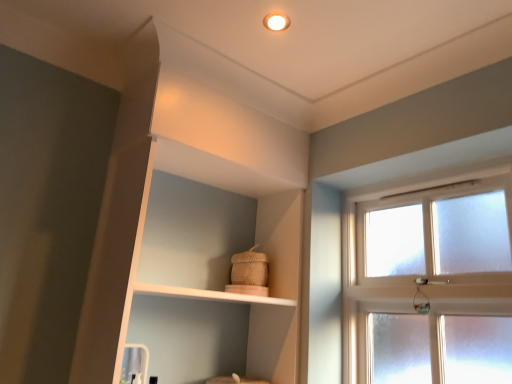
What is the approximate width of matte wicker basket at upper center?

matte wicker basket at upper center is 12.70 inches wide.

This screenshot has height=384, width=512. What do you see at coordinates (205, 232) in the screenshot?
I see `matte wicker basket at upper center` at bounding box center [205, 232].

Find the location of a particular element. matte wicker basket at upper center is located at coordinates (205, 232).

Locate an element on the screen. The width and height of the screenshot is (512, 384). matte wicker basket at upper center is located at coordinates (205, 232).